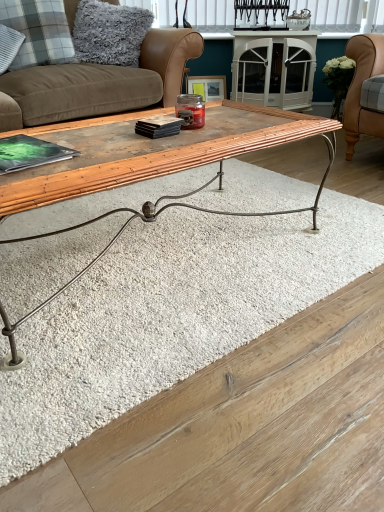
Question: From their relative heights in the image, would you say wooden bamboo coffee table at center is taller or shorter than white blinds at upper center?

Choices:
 (A) short
 (B) tall

Answer: (B)

Question: From a real-world perspective, is wooden bamboo coffee table at center physically located above or below white blinds at upper center?

Choices:
 (A) below
 (B) above

Answer: (A)

Question: Estimate the real-world distances between objects in this image. Which object is closer to the plaid fabric pillow at upper left, which is counted as the 1th pillow, starting from the left?

Choices:
 (A) wooden bamboo coffee table at center
 (B) white blinds at upper center
 (C) brown suede studio couch at upper left
 (D) gray fluffy pillow at upper left, the 2th pillow viewed from the left
 (E) wooden picture frame at center

Answer: (D)

Question: Which is nearer to the wooden bamboo coffee table at center?

Choices:
 (A) wooden picture frame at center
 (B) gray fluffy pillow at upper left, the 2th pillow viewed from the left
 (C) white blinds at upper center
 (D) plaid fabric pillow at upper left, which is counted as the 1th pillow, starting from the left
 (E) brown suede studio couch at upper left

Answer: (E)